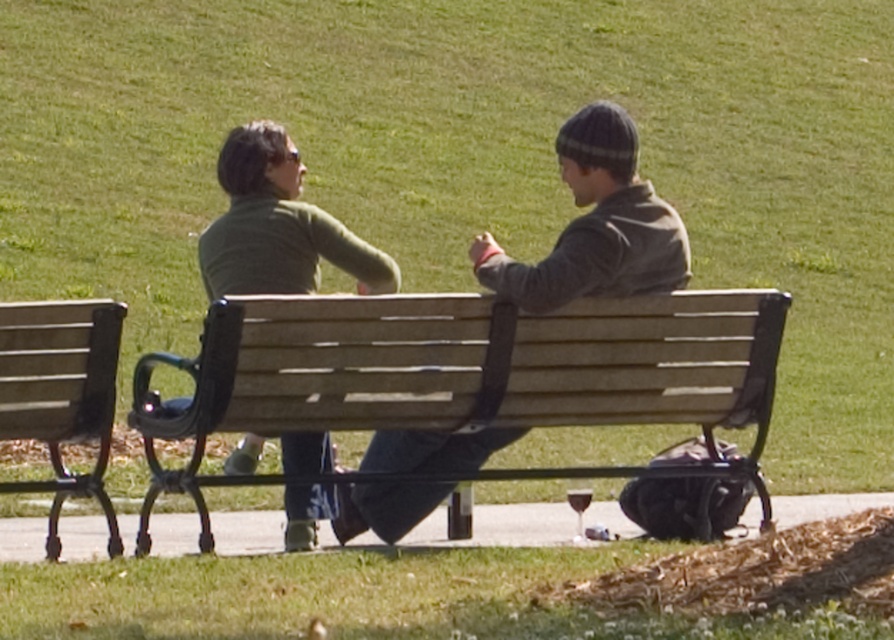
Question: Is wooden bench at center smaller than matte green sweater at center?

Choices:
 (A) yes
 (B) no

Answer: (B)

Question: Which of the following is the farthest from the observer?

Choices:
 (A) matte green sweater at center
 (B) wooden bench at left

Answer: (A)

Question: Which of the following is the closest to the observer?

Choices:
 (A) wooden bench at center
 (B) matte green sweater at center

Answer: (A)

Question: Is wooden bench at center to the right of wooden bench at left from the viewer's perspective?

Choices:
 (A) yes
 (B) no

Answer: (A)

Question: Estimate the real-world distances between objects in this image. Which object is farther from the wooden bench at left?

Choices:
 (A) wooden bench at center
 (B) matte green sweater at center

Answer: (B)

Question: Can you confirm if wooden bench at center is thinner than wooden bench at left?

Choices:
 (A) yes
 (B) no

Answer: (B)